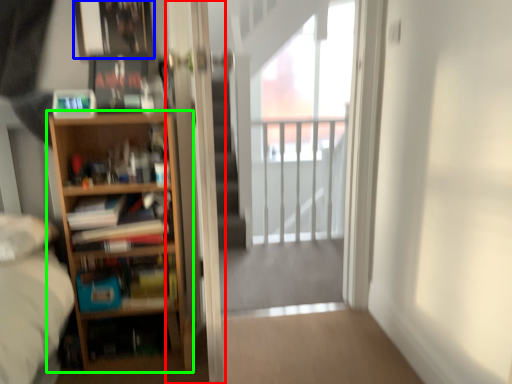
Question: Which object is the farthest from screen door (highlighted by a red box)? Choose among these: picture frame (highlighted by a blue box) or bookcase (highlighted by a green box).

Choices:
 (A) picture frame
 (B) bookcase

Answer: (A)